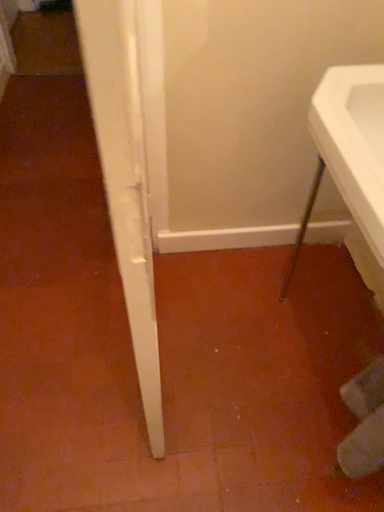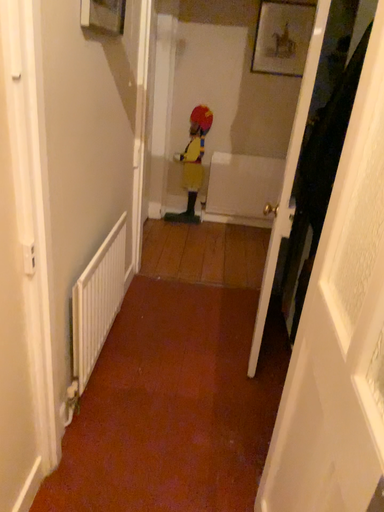
Question: How did the camera likely rotate when shooting the video?

Choices:
 (A) rotated downward
 (B) rotated upward

Answer: (B)